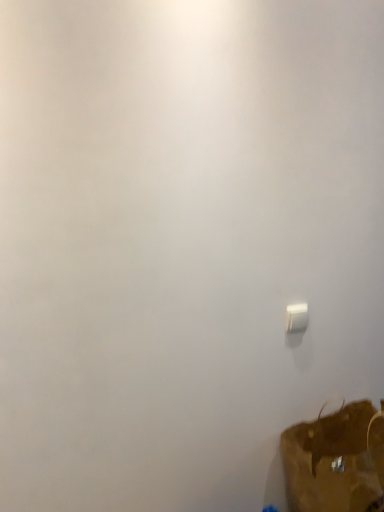
Question: Is brown fabric luggage at lower right outside of white plastic light switch at lower right?

Choices:
 (A) no
 (B) yes

Answer: (B)

Question: Can you confirm if brown fabric luggage at lower right is taller than white plastic light switch at lower right?

Choices:
 (A) yes
 (B) no

Answer: (A)

Question: Is brown fabric luggage at lower right at the left side of white plastic light switch at lower right?

Choices:
 (A) no
 (B) yes

Answer: (A)

Question: From the image's perspective, is brown fabric luggage at lower right on white plastic light switch at lower right?

Choices:
 (A) yes
 (B) no

Answer: (B)

Question: Considering the relative sizes of brown fabric luggage at lower right and white plastic light switch at lower right in the image provided, is brown fabric luggage at lower right wider than white plastic light switch at lower right?

Choices:
 (A) no
 (B) yes

Answer: (B)

Question: From a real-world perspective, is brown fabric luggage at lower right physically below white plastic light switch at lower right?

Choices:
 (A) no
 (B) yes

Answer: (B)

Question: Is white plastic light switch at lower right completely or partially outside of brown fabric luggage at lower right?

Choices:
 (A) yes
 (B) no

Answer: (A)

Question: Is white plastic light switch at lower right aimed at brown fabric luggage at lower right?

Choices:
 (A) yes
 (B) no

Answer: (B)

Question: Considering the relative sizes of white plastic light switch at lower right and brown fabric luggage at lower right in the image provided, is white plastic light switch at lower right taller than brown fabric luggage at lower right?

Choices:
 (A) no
 (B) yes

Answer: (A)

Question: Is white plastic light switch at lower right to the left of brown fabric luggage at lower right from the viewer's perspective?

Choices:
 (A) no
 (B) yes

Answer: (B)

Question: Is white plastic light switch at lower right oriented away from brown fabric luggage at lower right?

Choices:
 (A) no
 (B) yes

Answer: (A)

Question: From a real-world perspective, is white plastic light switch at lower right located higher than brown fabric luggage at lower right?

Choices:
 (A) yes
 (B) no

Answer: (A)

Question: In the image, is brown fabric luggage at lower right positioned in front of or behind white plastic light switch at lower right?

Choices:
 (A) behind
 (B) front

Answer: (B)